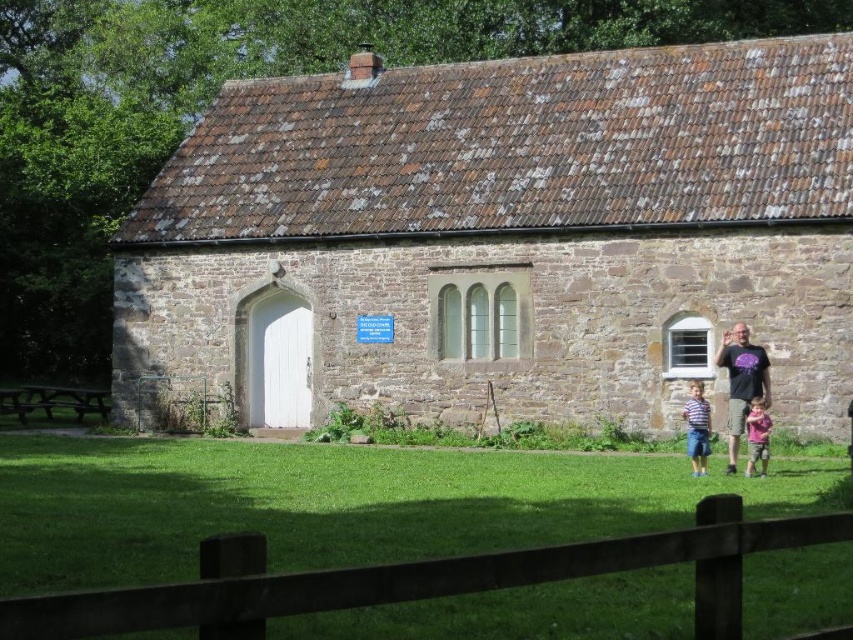
You are standing in front of a historic building and notice the brown stone church at center and the brown wooden fence at lower center. Which object is wider?

The brown stone church at center is wider than the brown wooden fence at lower center.

You are standing in front of the brown stone church at center and want to see the brown wooden fence at lower center. In which direction should you look?

The brown wooden fence at lower center is below the brown stone church at center, so you should look downward to see it.